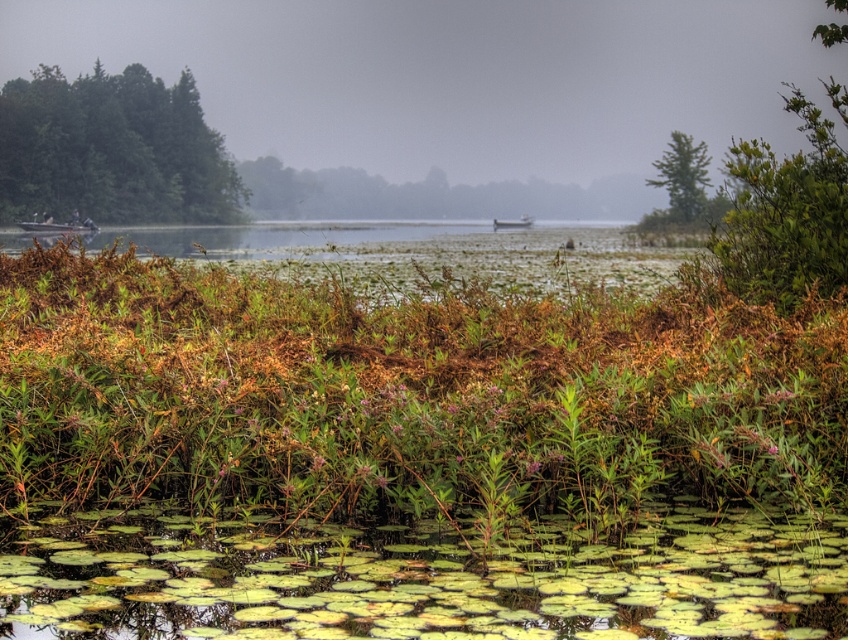
Question: Among these objects, which one is nearest to the camera?

Choices:
 (A) green leafy trees at upper left
 (B) white plastic boat at center
 (C) green leafy bush at upper right

Answer: (C)

Question: Does green leafy trees at upper left have a larger size compared to green leafy tree at upper right?

Choices:
 (A) no
 (B) yes

Answer: (B)

Question: Is green leafy bush at upper right above wooden boat at left?

Choices:
 (A) no
 (B) yes

Answer: (B)

Question: Based on their relative distances, which object is nearer to the green leafy trees at upper left?

Choices:
 (A) green leafy bush at upper right
 (B) foggy mist at center
 (C) green leafy tree at upper right
 (D) white plastic boat at center

Answer: (B)

Question: Is green leafy trees at upper left positioned behind green leafy bush at upper right?

Choices:
 (A) no
 (B) yes

Answer: (B)

Question: Which point appears closest to the camera in this image?

Choices:
 (A) (523, 227)
 (B) (679, 144)
 (C) (48, 230)

Answer: (C)